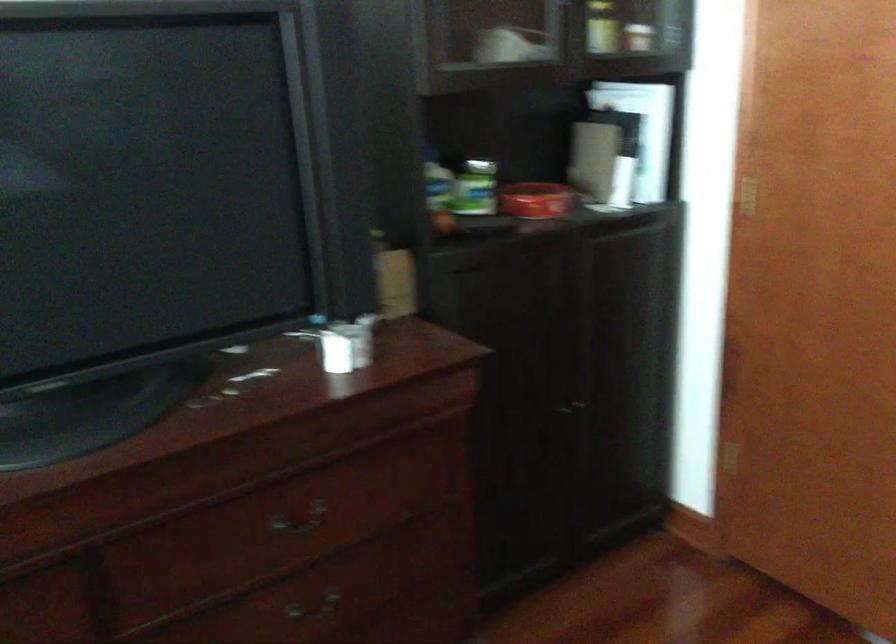
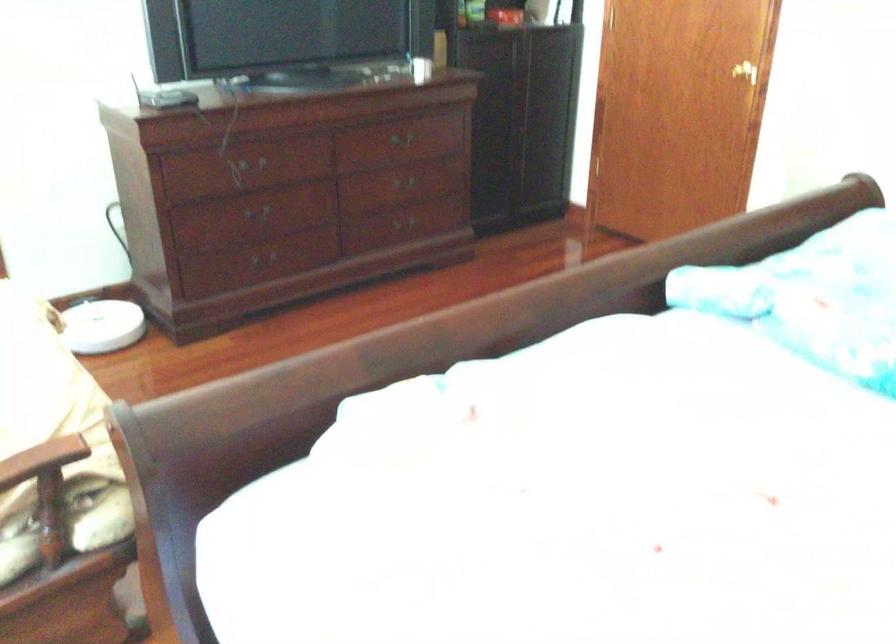
Question: The images are taken continuously from a first-person perspective. In which direction are you moving?

Choices:
 (A) Left
 (B) Right
 (C) Forward
 (D) Backward

Answer: (D)